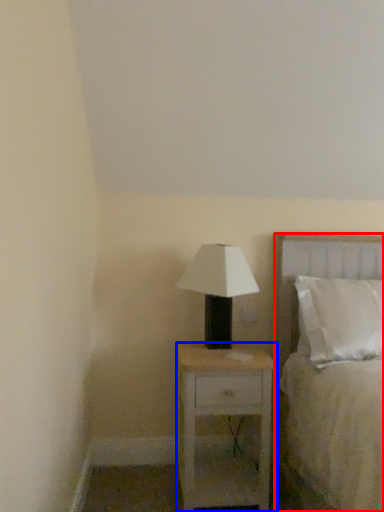
Question: Which object is closer to the camera taking this photo, bed (highlighted by a red box) or nightstand (highlighted by a blue box)?

Choices:
 (A) bed
 (B) nightstand

Answer: (A)